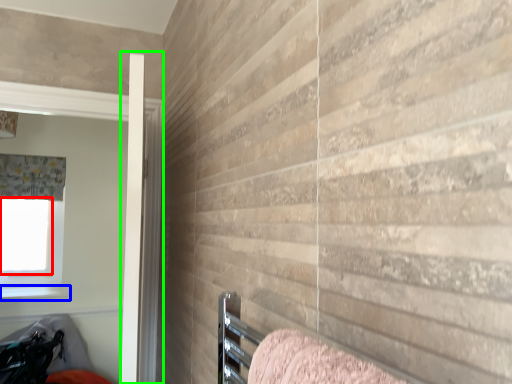
Question: Which object is the closest to the window screen (highlighted by a red box)? Choose among these: window sill (highlighted by a blue box) or screen door (highlighted by a green box).

Choices:
 (A) window sill
 (B) screen door

Answer: (A)